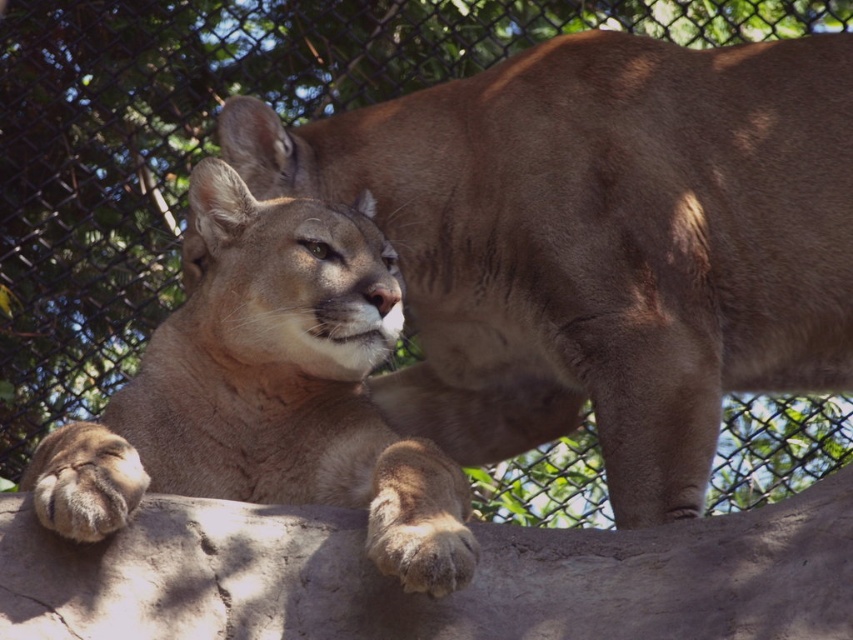
You are a zookeeper observing the light brown fur cougar at center and the gray rough stone at center. Which object is located to the right of the cougar?

The gray rough stone at center is positioned on the right side of the light brown fur cougar at center.

You are a zookeeper observing the enclosure. You notice the gray rough stone at center and the light brown fur cougar at center. Which object is positioned lower in the scene?

The gray rough stone at center is positioned below the light brown fur cougar at center, so it is lower in the scene.